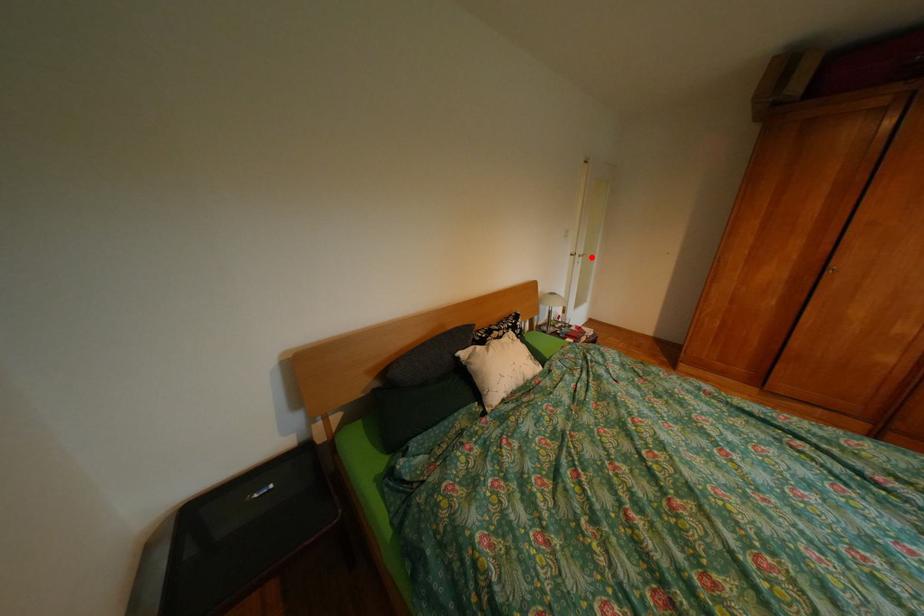
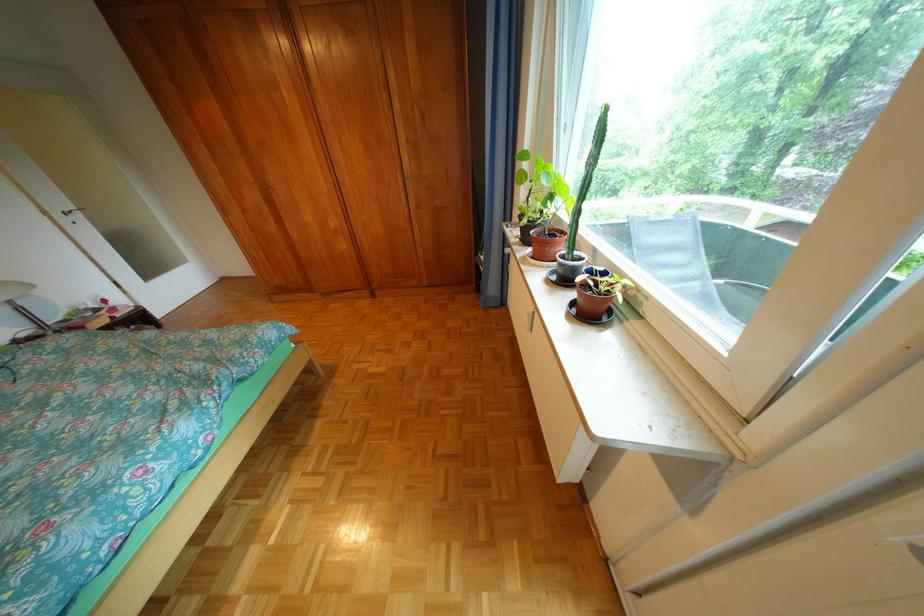
Question: I am providing you with two images of the same scene from different viewpoints. A red point is shown in image1. For the corresponding object point in image2, is it positioned nearer or farther from the camera?

Choices:
 (A) Nearer
 (B) Farther

Answer: (B)